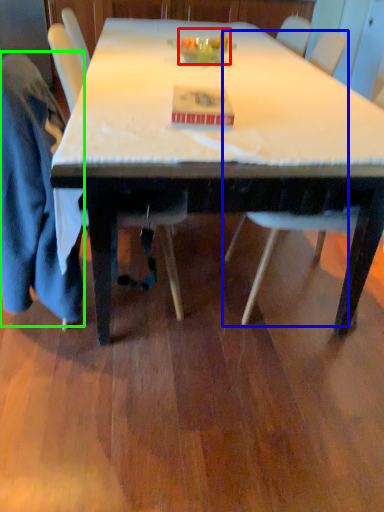
Question: Which object is the closest to the food (highlighted by a red box)? Choose among these: chair (highlighted by a blue box) or robe (highlighted by a green box).

Choices:
 (A) chair
 (B) robe

Answer: (A)